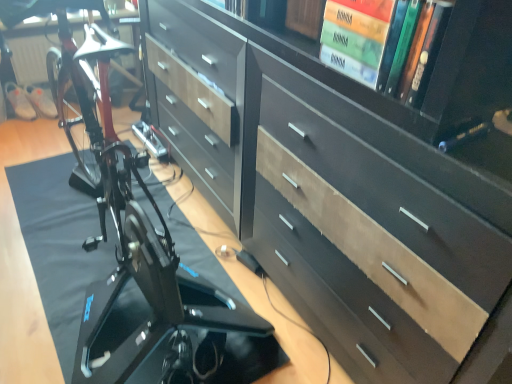
Identify the location of vacant point above black glossy bicycle at lower left (from a real-world perspective). Image resolution: width=512 pixels, height=384 pixels. (92, 247).